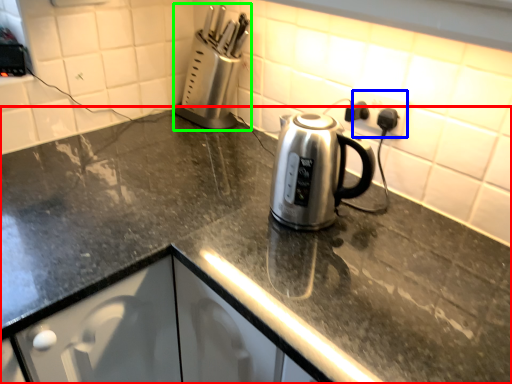
Question: Estimate the real-world distances between objects in this image. Which object is closer to countertop (highlighted by a red box), electric outlet (highlighted by a blue box) or appliance (highlighted by a green box)?

Choices:
 (A) electric outlet
 (B) appliance

Answer: (A)